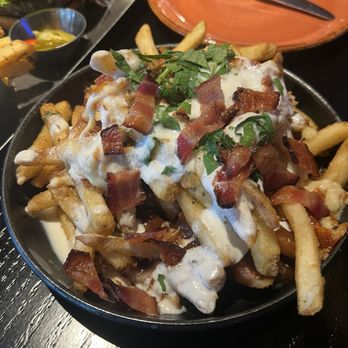
This screenshot has width=348, height=348. Find the location of `table`. table is located at coordinates (44, 319).